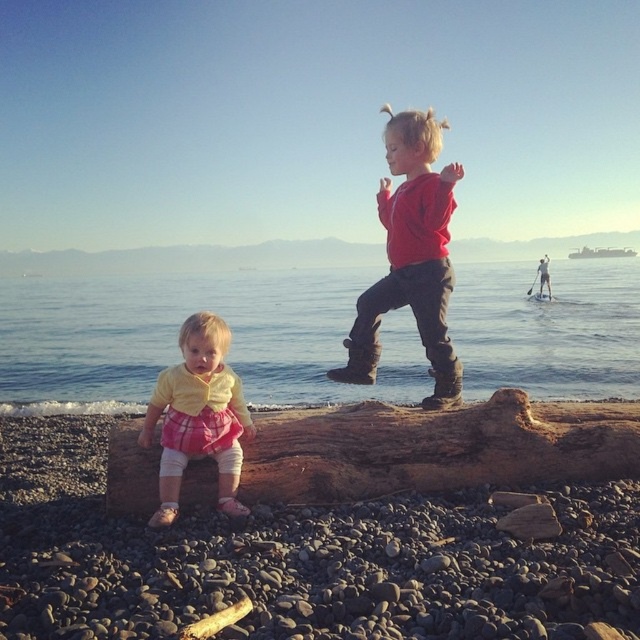
What do you see at coordinates (300, 557) in the screenshot?
I see `smooth brown log at center` at bounding box center [300, 557].

Between point (554, 492) and point (547, 268), which one is positioned behind?

The point (547, 268) is more distant.

Which is behind, point (449, 572) or point (548, 291)?

Point (548, 291)

The height and width of the screenshot is (640, 640). In order to click on smooth brown log at center in this screenshot , I will do `click(300, 557)`.

Can you confirm if red matte sweater at center is thinner than yellow cotton shirt at center?

In fact, red matte sweater at center might be wider than yellow cotton shirt at center.

Between red matte sweater at center and yellow cotton shirt at center, which one appears on the left side from the viewer's perspective?

yellow cotton shirt at center is more to the left.

Is point (442, 365) closer to camera compared to point (202, 376)?

No, it is behind (202, 376).

Find the location of `red matte sweater at center`. red matte sweater at center is located at coordinates (412, 257).

Measure the distance between brown rough wood at center and red matte sweater at center.

brown rough wood at center and red matte sweater at center are 3.48 feet apart from each other.

Can you confirm if brown rough wood at center is bigger than red matte sweater at center?

Incorrect, brown rough wood at center is not larger than red matte sweater at center.

Between point (564, 422) and point (406, 202), which one is positioned behind?

Positioned behind is point (564, 422).

In order to click on brown rough wood at center in this screenshot , I will do `click(435, 449)`.